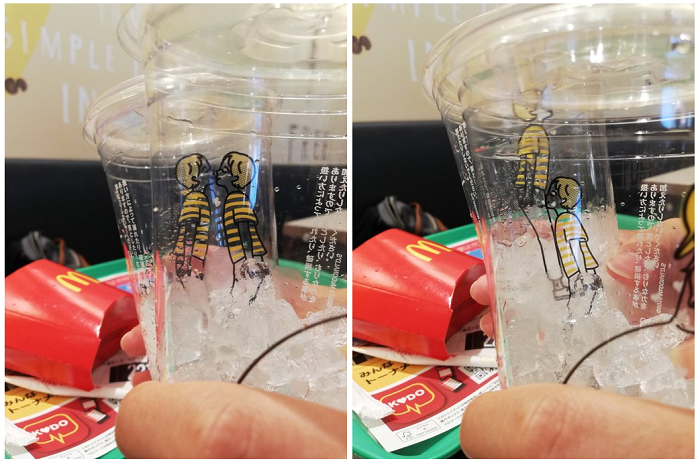
Identify the location of wall. (43, 67), (393, 79).